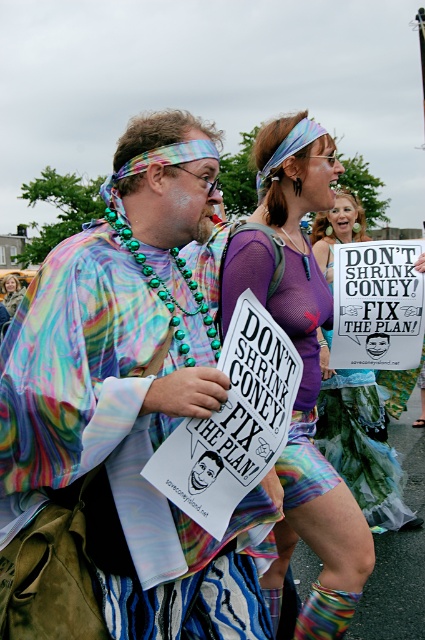
Who is positioned more to the right, matte purple mesh top at center or rainbow fabric scarf at upper left?

matte purple mesh top at center

Is matte purple mesh top at center to the right of rainbow fabric scarf at upper left from the viewer's perspective?

Yes, matte purple mesh top at center is to the right of rainbow fabric scarf at upper left.

What do you see at coordinates (303, 371) in the screenshot?
I see `matte purple mesh top at center` at bounding box center [303, 371].

Where is `matte purple mesh top at center`? This screenshot has height=640, width=425. matte purple mesh top at center is located at coordinates (x=303, y=371).

Is rainbow tie-dye shirt at center wider than multicolored fabric skirt at center?

Correct, the width of rainbow tie-dye shirt at center exceeds that of multicolored fabric skirt at center.

This screenshot has height=640, width=425. What are the coordinates of `rainbow tie-dye shirt at center` in the screenshot? It's located at (124, 412).

Who is shorter, rainbow tie-dye shirt at center or rainbow fabric scarf at upper left?

With less height is rainbow fabric scarf at upper left.

Who is higher up, rainbow tie-dye shirt at center or rainbow fabric scarf at upper left?

rainbow fabric scarf at upper left is above.

Does point (30, 307) come in front of point (3, 298)?

Yes, point (30, 307) is in front of point (3, 298).

Where is `rainbow tie-dye shirt at center`? rainbow tie-dye shirt at center is located at coordinates click(124, 412).